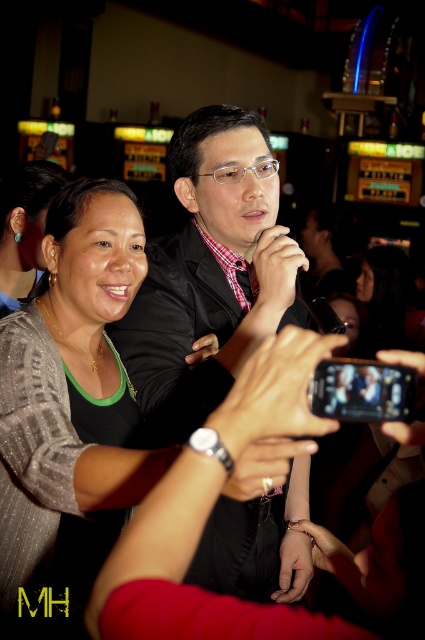
Consider the image. Based on the scene description, where is the sparkly silver blouse at center located in the image?

The sparkly silver blouse at center is located at point 0.633 on the x axis and 0.167 on the y axis.

In the scene described, there is a sparkly silver blouse at center and a turquoise gemstone earring at left. From the perspective of someone facing the scene, which object is positioned to the right of the other?

The sparkly silver blouse at center is to the right of the turquoise gemstone earring at left.